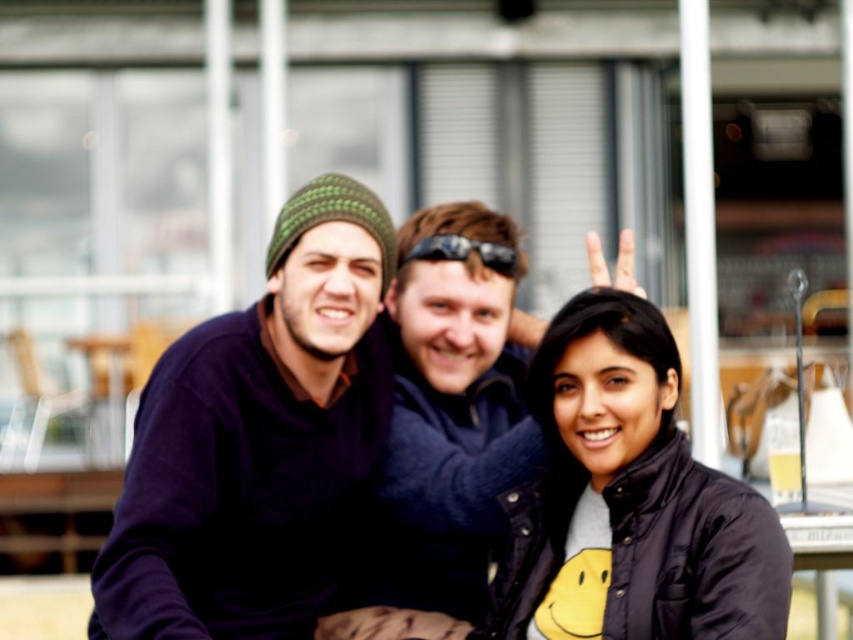
Can you confirm if matte black sweater at center is thinner than black rubber sunglasses at center?

No, matte black sweater at center is not thinner than black rubber sunglasses at center.

Which is in front, point (537, 490) or point (491, 250)?

Point (537, 490) is more forward.

This screenshot has height=640, width=853. Describe the element at coordinates (630, 500) in the screenshot. I see `matte black sweater at center` at that location.

What are the coordinates of `matte black sweater at center` in the screenshot? It's located at (630, 500).

Does matte black sweater at center come behind dark blue sweater at center?

No, matte black sweater at center is closer to the viewer.

The width and height of the screenshot is (853, 640). Describe the element at coordinates (630, 500) in the screenshot. I see `matte black sweater at center` at that location.

Locate an element on the screen. matte black sweater at center is located at coordinates (630, 500).

Between matte purple sweater at left and dark blue jacket at center, which one has less height?

dark blue jacket at center

Is the position of matte purple sweater at left more distant than that of dark blue jacket at center?

Yes.

Locate an element on the screen. The width and height of the screenshot is (853, 640). matte purple sweater at left is located at coordinates (257, 440).

This screenshot has height=640, width=853. I want to click on matte purple sweater at left, so click(x=257, y=440).